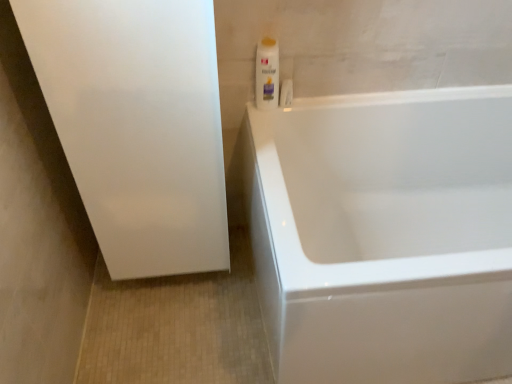
The image size is (512, 384). In order to click on white glossy bathtub at right in this screenshot , I will do `click(384, 234)`.

The height and width of the screenshot is (384, 512). What do you see at coordinates (137, 125) in the screenshot?
I see `white matte screen door at left` at bounding box center [137, 125].

Describe the element at coordinates (267, 74) in the screenshot. I see `white plastic bottle at upper right` at that location.

The height and width of the screenshot is (384, 512). Find the location of `white glossy bathtub at right`. white glossy bathtub at right is located at coordinates (384, 234).

How distant is white matte screen door at left from white glossy bathtub at right?

A distance of 19.44 inches exists between white matte screen door at left and white glossy bathtub at right.

From a real-world perspective, is white matte screen door at left located higher than white glossy bathtub at right?

Correct, in the physical world, white matte screen door at left is higher than white glossy bathtub at right.

Considering the relative sizes of white matte screen door at left and white glossy bathtub at right in the image provided, is white matte screen door at left smaller than white glossy bathtub at right?

Yes, white matte screen door at left is smaller than white glossy bathtub at right.

From a real-world perspective, is white glossy bathtub at right over white plastic bottle at upper right?

No.

Is white plastic bottle at upper right at the back of white glossy bathtub at right?

Absolutely, white glossy bathtub at right is directed away from white plastic bottle at upper right.

From a real-world perspective, is white plastic bottle at upper right physically below white matte screen door at left?

No.

Does white plastic bottle at upper right have a larger size compared to white matte screen door at left?

Actually, white plastic bottle at upper right might be smaller than white matte screen door at left.

Based on the photo, is white matte screen door at left touching white plastic bottle at upper right?

white matte screen door at left is not next to white plastic bottle at upper right, and they're not touching.

Is white matte screen door at left oriented away from white plastic bottle at upper right?

That's not correct — white matte screen door at left is not looking away from white plastic bottle at upper right.

Looking at the image, does white matte screen door at left seem bigger or smaller compared to white plastic bottle at upper right?

In the image, white matte screen door at left appears to be larger than white plastic bottle at upper right.

Looking at this image, in terms of height, does white matte screen door at left look taller or shorter compared to white plastic bottle at upper right?

Considering their sizes, white matte screen door at left has more height than white plastic bottle at upper right.

The height and width of the screenshot is (384, 512). I want to click on screen door above the white glossy bathtub at right (from the image's perspective), so click(137, 125).

Which of these two, white glossy bathtub at right or white matte screen door at left, is wider?

With larger width is white glossy bathtub at right.

Is white glossy bathtub at right closer to camera compared to white matte screen door at left?

Yes, white glossy bathtub at right is in front of white matte screen door at left.

Is white glossy bathtub at right bigger than white matte screen door at left?

Yes.

In order to click on bathtub directly beneath the white plastic bottle at upper right (from a real-world perspective) in this screenshot , I will do `click(384, 234)`.

From the image's perspective, between white plastic bottle at upper right and white glossy bathtub at right, who is located below?

white glossy bathtub at right.

Is white plastic bottle at upper right inside or outside of white glossy bathtub at right?

white plastic bottle at upper right can be found inside white glossy bathtub at right.

Is point (273, 59) more distant than point (274, 284)?

Yes, it is behind point (274, 284).

Find the location of a particular element. screen door behind the white glossy bathtub at right is located at coordinates (137, 125).

You are a GUI agent. You are given a task and a screenshot of the screen. Output one action in this format:
    pyautogui.click(x=<x>, y=<y>)
    Task: Click on the bathtub below the white plastic bottle at upper right (from the image's perspective)
    The width and height of the screenshot is (512, 384).
    Given the screenshot: What is the action you would take?
    pyautogui.click(x=384, y=234)

Based on their spatial positions, is white plastic bottle at upper right or white matte screen door at left closer to white glossy bathtub at right?

white matte screen door at left lies closer to white glossy bathtub at right than the other object.

Consider the image. Based on their spatial positions, is white matte screen door at left or white glossy bathtub at right further from white plastic bottle at upper right?

white glossy bathtub at right is positioned further to the anchor white plastic bottle at upper right.

When comparing their distances from white glossy bathtub at right, does white matte screen door at left or white plastic bottle at upper right seem closer?

The object closer to white glossy bathtub at right is white matte screen door at left.

Which object lies nearer to the anchor point white matte screen door at left, white plastic bottle at upper right or white glossy bathtub at right?

The object closer to white matte screen door at left is white plastic bottle at upper right.

From the image, which object appears to be nearer to white plastic bottle at upper right, white glossy bathtub at right or white matte screen door at left?

The object closer to white plastic bottle at upper right is white matte screen door at left.

Which object lies nearer to the anchor point white matte screen door at left, white glossy bathtub at right or white plastic bottle at upper right?

white plastic bottle at upper right.

In order to click on cleaning product between white matte screen door at left and white glossy bathtub at right from left to right in this screenshot , I will do `click(267, 74)`.